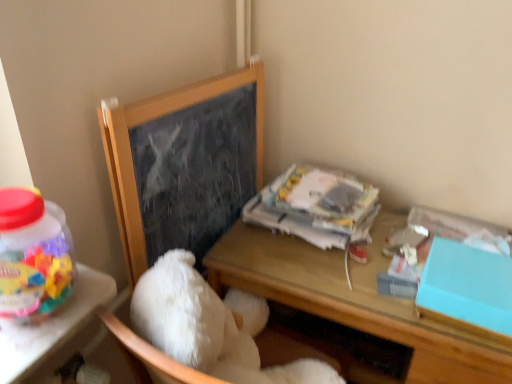
Question: Is the position of white paper at upper right less distant than that of wooden chalkboard at upper left?

Choices:
 (A) yes
 (B) no

Answer: (B)

Question: Would you say white paper at upper right is outside wooden chalkboard at upper left?

Choices:
 (A) yes
 (B) no

Answer: (A)

Question: Does white paper at upper right have a smaller size compared to wooden chalkboard at upper left?

Choices:
 (A) yes
 (B) no

Answer: (B)

Question: Considering the relative sizes of white paper at upper right and wooden chalkboard at upper left in the image provided, is white paper at upper right shorter than wooden chalkboard at upper left?

Choices:
 (A) no
 (B) yes

Answer: (B)

Question: Considering the relative sizes of white paper at upper right and wooden chalkboard at upper left in the image provided, is white paper at upper right wider than wooden chalkboard at upper left?

Choices:
 (A) no
 (B) yes

Answer: (B)

Question: Does white paper at upper right have a greater height compared to wooden chalkboard at upper left?

Choices:
 (A) yes
 (B) no

Answer: (B)

Question: Is teal matte box at right completely or partially outside of wooden chalkboard at upper left?

Choices:
 (A) no
 (B) yes

Answer: (B)

Question: Is teal matte box at right turned away from wooden chalkboard at upper left?

Choices:
 (A) no
 (B) yes

Answer: (A)

Question: Does teal matte box at right have a greater height compared to wooden chalkboard at upper left?

Choices:
 (A) no
 (B) yes

Answer: (A)

Question: Is teal matte box at right aimed at wooden chalkboard at upper left?

Choices:
 (A) no
 (B) yes

Answer: (A)

Question: From the image's perspective, is teal matte box at right located beneath wooden chalkboard at upper left?

Choices:
 (A) yes
 (B) no

Answer: (A)

Question: Is wooden chalkboard at upper left completely or partially inside teal matte box at right?

Choices:
 (A) yes
 (B) no

Answer: (B)

Question: Is the depth of white fluffy teddy bear at center less than that of wooden chalkboard at upper left?

Choices:
 (A) yes
 (B) no

Answer: (A)